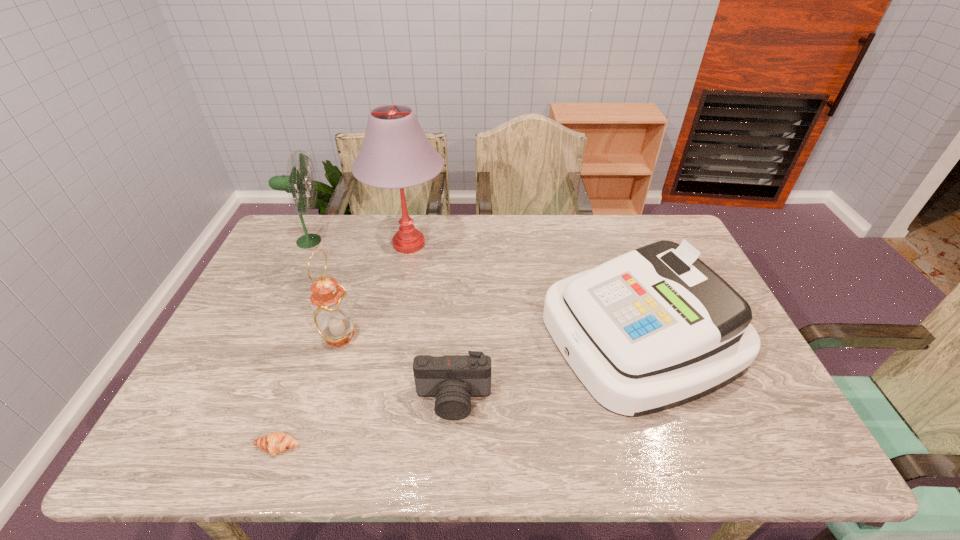
The width and height of the screenshot is (960, 540). I want to click on vacant space at the near edge of the desktop, so click(357, 426).

At what (x,y) coordinates should I click in order to perform the action: click on vacant area at the left edge. Please return your answer as a coordinate pair (x, y). The height and width of the screenshot is (540, 960). Looking at the image, I should click on (260, 273).

Locate an element on the screen. vacant space at the near left corner is located at coordinates (195, 450).

Locate an element on the screen. The width and height of the screenshot is (960, 540). free area in between the shortest object and the fan is located at coordinates (293, 344).

The height and width of the screenshot is (540, 960). I want to click on vacant area that lies between the shortest object and the camera, so click(x=366, y=423).

Locate an element on the screen. The height and width of the screenshot is (540, 960). unoccupied area between the pastry and the table lamp is located at coordinates (344, 346).

The image size is (960, 540). I want to click on free space between the leftmost object and the shortest object, so click(x=293, y=344).

The height and width of the screenshot is (540, 960). In order to click on vacant space in between the cash register and the camera in this screenshot , I will do `click(547, 367)`.

The width and height of the screenshot is (960, 540). Find the location of `vacant point located between the rightmost object and the oil lamp`. vacant point located between the rightmost object and the oil lamp is located at coordinates (490, 335).

Locate an element on the screen. Image resolution: width=960 pixels, height=540 pixels. vacant region between the nearest object and the fifth tallest object is located at coordinates (366, 423).